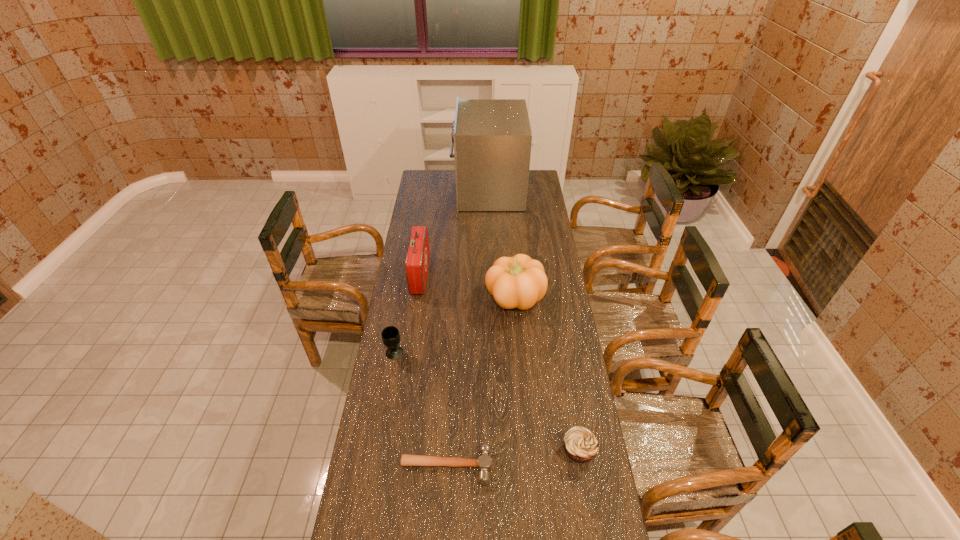
Find the location of a particular element. The image size is (960, 540). vacant space located on the front panel of the farthest object is located at coordinates (437, 190).

Locate an element on the screen. The width and height of the screenshot is (960, 540). vacant space located on the side of the first-aid kit with the first aid cross symbol is located at coordinates (443, 276).

The height and width of the screenshot is (540, 960). I want to click on vacant space located 0.380m on the front of the pumpkin, so click(523, 395).

Locate an element on the screen. Image resolution: width=960 pixels, height=540 pixels. free location located 0.310m on the back of the fourth tallest object is located at coordinates (405, 292).

Locate an element on the screen. The height and width of the screenshot is (540, 960). free region located 0.360m on the back of the muffin is located at coordinates (562, 350).

The height and width of the screenshot is (540, 960). In order to click on free space located 0.120m on the left of the hammer in this screenshot , I will do `click(364, 466)`.

Identify the location of object at the far edge. The image size is (960, 540). (492, 138).

Find the location of a particular element. The height and width of the screenshot is (540, 960). the first-aid kit at the left edge is located at coordinates (417, 258).

Find the location of a particular element. This screenshot has height=540, width=960. chalice present at the left edge is located at coordinates (390, 335).

This screenshot has height=540, width=960. I want to click on hammer present at the left edge, so click(483, 462).